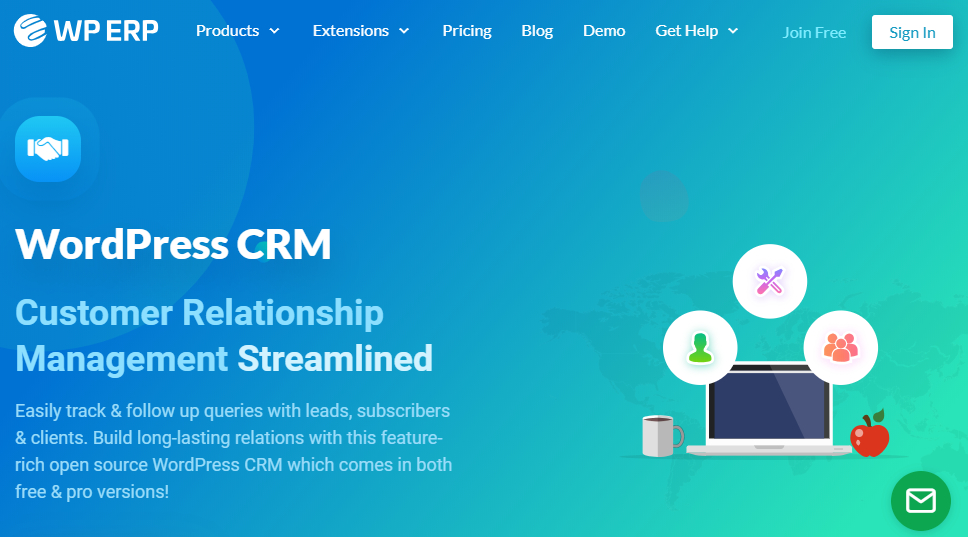
Locate an element on the screen. The height and width of the screenshot is (537, 968). mug is located at coordinates (657, 429).